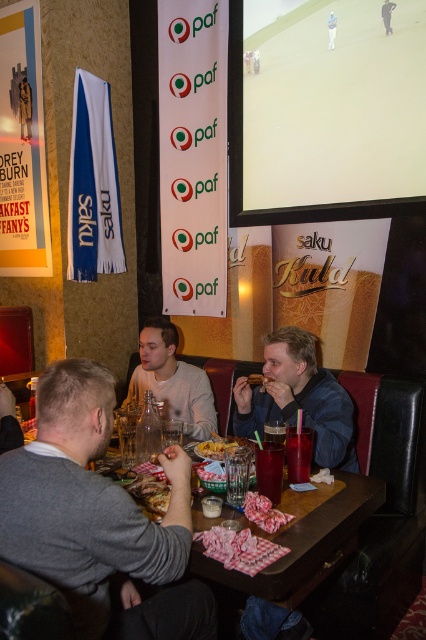
Who is more distant from viewer, (175, 346) or (293, 481)?

Positioned behind is point (175, 346).

Is point (189, 410) behind point (302, 452)?

Yes, it is behind point (302, 452).

Find the location of a particular element. Image resolution: width=426 pixels, height=640 pixels. light gray sweater at center is located at coordinates (172, 380).

Between point (275, 630) and point (288, 444), which one is positioned in front?

Point (288, 444)

Consider the image. Is wooden table at center thinner than translucent plastic cup at table center?

In fact, wooden table at center might be wider than translucent plastic cup at table center.

Is point (365, 481) closer to camera compared to point (296, 468)?

That is False.

Find the location of a particular element. The height and width of the screenshot is (640, 426). wooden table at center is located at coordinates (305, 500).

From the picture: Who is lower down, gray sweater at center or wooden table at center?

wooden table at center is lower down.

Between point (60, 536) and point (316, 532), which one is positioned in front?

Positioned in front is point (60, 536).

What are the coordinates of `gray sweater at center` in the screenshot? It's located at (97, 516).